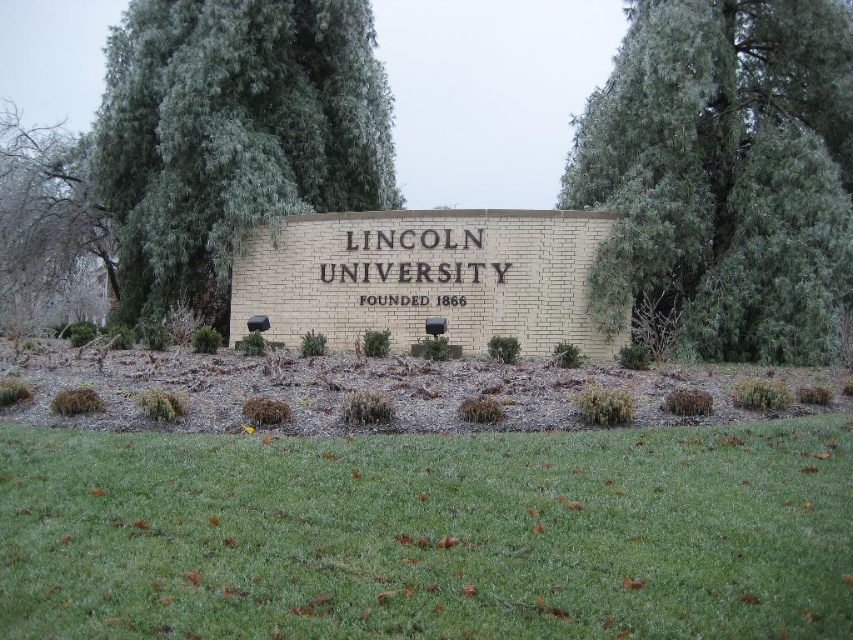
Question: Among these points, which one is nearest to the camera?

Choices:
 (A) (198, 118)
 (B) (9, 225)

Answer: (A)

Question: Is green needle-like leaves at upper center thinner than green leafy tree at left?

Choices:
 (A) yes
 (B) no

Answer: (A)

Question: Which object is positioned farthest from the green leafy tree at upper left?

Choices:
 (A) green leafy tree at left
 (B) green grass at lower center
 (C) green needle-like leaves at upper center

Answer: (B)

Question: Can you confirm if green grass at lower center is smaller than green needle-like leaves at upper center?

Choices:
 (A) no
 (B) yes

Answer: (B)

Question: Which point is closer to the camera?

Choices:
 (A) green leafy tree at upper left
 (B) green grass at lower center
 (C) green leafy tree at left

Answer: (B)

Question: Does green leafy tree at upper left have a lesser width compared to green leafy tree at left?

Choices:
 (A) yes
 (B) no

Answer: (A)